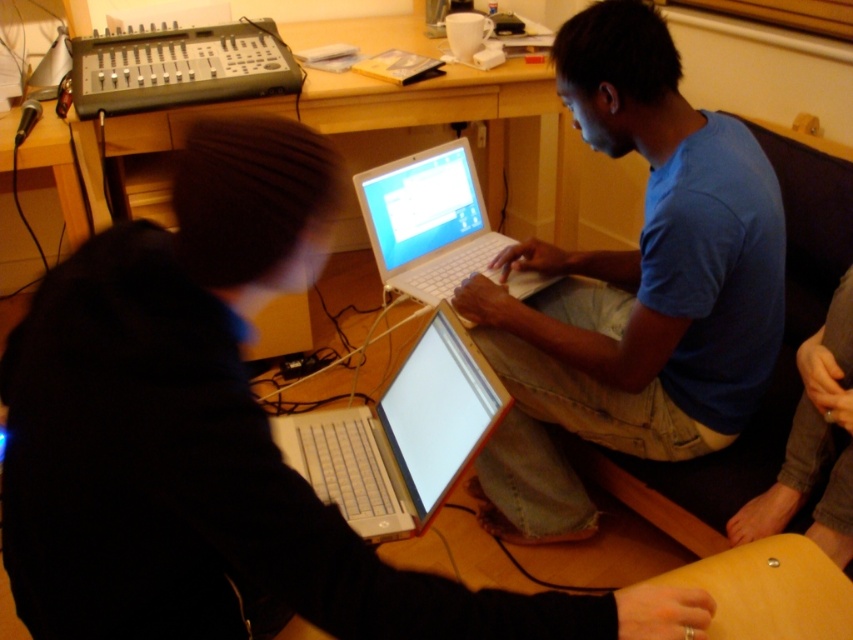
You are standing in the room and see two points marked in the image. Which point is nearer to you, point (456, 472) or point (190, 64)?

Point (456, 472) is closer to the viewer than point (190, 64).

You are a delivery person who needs to place a package on the table. The package is exactly the same height as the dark gray fabric pants at lower right. Can the package fit vertically on the table where the silver metallic laptop at center is currently placed?

The silver metallic laptop at center is shorter than the dark gray fabric pants at lower right. Since the package has the same height as the pants, it would be taller than the laptop. Therefore, the package may not fit vertically on the table if the space allocated for the laptop is limited to its current height.